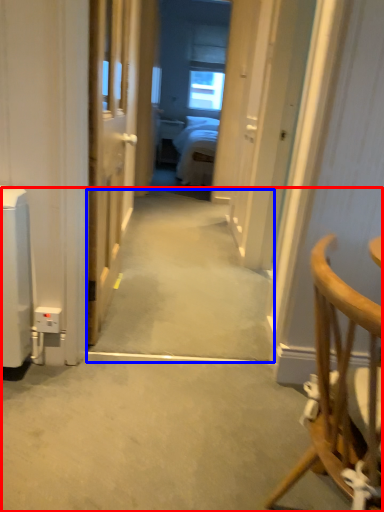
Question: Which object is closer to the camera taking this photo, path (highlighted by a red box) or path (highlighted by a blue box)?

Choices:
 (A) path
 (B) path

Answer: (A)